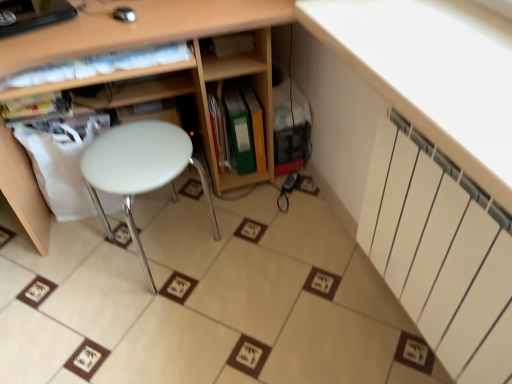
Question: From their relative heights in the image, would you say white glossy radiator at upper right is taller or shorter than green matte folder at center, positioned as the second book in left-to-right order?

Choices:
 (A) tall
 (B) short

Answer: (B)

Question: From a real-world perspective, relative to green matte folder at center, which appears as the 2th book when viewed from the right, is white glossy radiator at upper right vertically above or below?

Choices:
 (A) below
 (B) above

Answer: (B)

Question: Considering the real-world distances, which object is farthest from the wooden at center?

Choices:
 (A) white glossy radiator at upper right
 (B) matte white book at upper left, the first book from the left
 (C) green matte folder at center, positioned as the first book in right-to-left order
 (D) white plastic stool at center
 (E) green matte folder at center, positioned as the second book in left-to-right order

Answer: (A)

Question: Based on their relative distances, which object is farther from the green matte folder at center, which appears as the 2th book when viewed from the right?

Choices:
 (A) green matte folder at center, the third book from the left
 (B) white plastic stool at center
 (C) white glossy radiator at upper right
 (D) white matte radiator at upper right
 (E) wooden at center

Answer: (C)